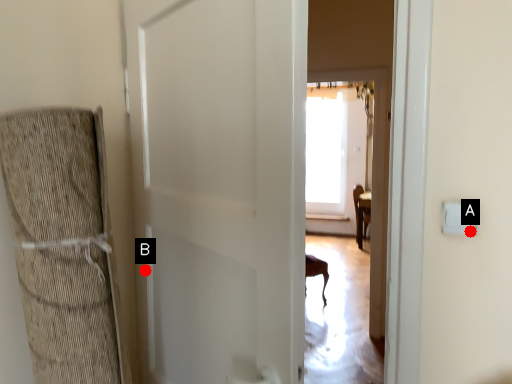
Question: Two points are circled on the image, labeled by A and B beside each circle. Which point appears farthest from the camera in this image?

Choices:
 (A) A is further
 (B) B is further

Answer: (B)